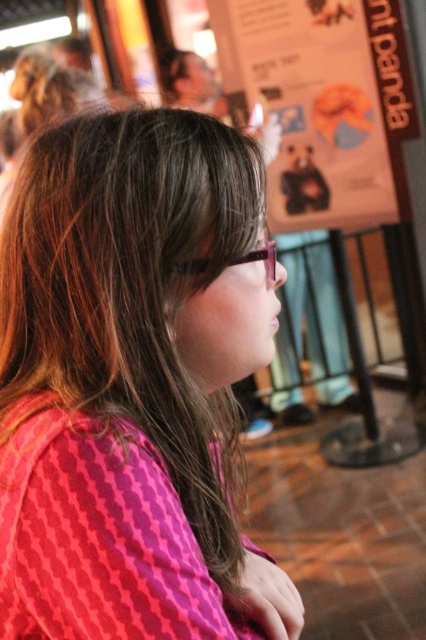
You are a photographer who wants to capture a photo of the white paper poster at upper center without including the matte plastic glasses at center in the frame. Based on their positions, can you position yourself in a way to achieve this?

The white paper poster at upper center is to the right of the matte plastic glasses at center, so by angling the camera to the right side of the glasses, you can exclude the glasses from the frame while capturing the poster.

You are a photographer trying to capture a candid shot of the person in the scene. To ensure the pink fabric shirt at center and the matte plastic glasses at center are both in focus, which object should you adjust your camera focus on first?

The pink fabric shirt at center is below matte plastic glasses at center. Since the glasses are closer to the camera, you should focus on the matte plastic glasses at center first to ensure both objects are in focus.